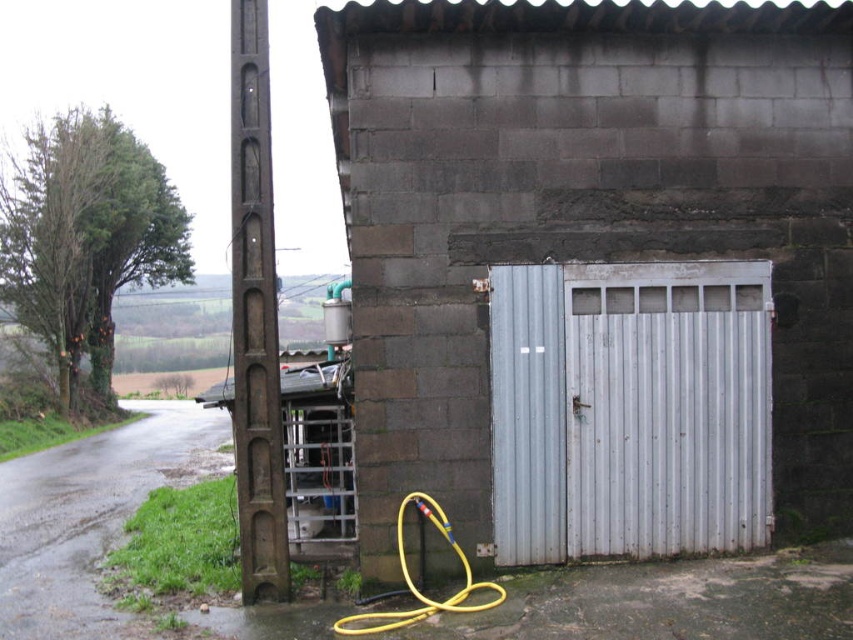
Consider the image. Who is more distant from viewer, (503, 428) or (495, 604)?

The point (503, 428) is more distant.

The width and height of the screenshot is (853, 640). What do you see at coordinates (630, 410) in the screenshot?
I see `white corrugated metal garage door at center` at bounding box center [630, 410].

The width and height of the screenshot is (853, 640). Find the location of `white corrugated metal garage door at center`. white corrugated metal garage door at center is located at coordinates (630, 410).

Does wet asphalt road at lower left appear on the right side of yellow rubber garden hose at lower center?

Incorrect, wet asphalt road at lower left is not on the right side of yellow rubber garden hose at lower center.

Is wet asphalt road at lower left closer to the viewer compared to yellow rubber garden hose at lower center?

No, it is not.

What are the coordinates of `wet asphalt road at lower left` in the screenshot? It's located at (90, 516).

Image resolution: width=853 pixels, height=640 pixels. Describe the element at coordinates (630, 410) in the screenshot. I see `white corrugated metal garage door at center` at that location.

Consider the image. Is white corrugated metal garage door at center below wet asphalt road at lower left?

No.

Does point (758, 397) come behind point (149, 480)?

No, it is not.

At what (x,y) coordinates should I click in order to perform the action: click on white corrugated metal garage door at center. Please return your answer as a coordinate pair (x, y). The width and height of the screenshot is (853, 640). Looking at the image, I should click on (630, 410).